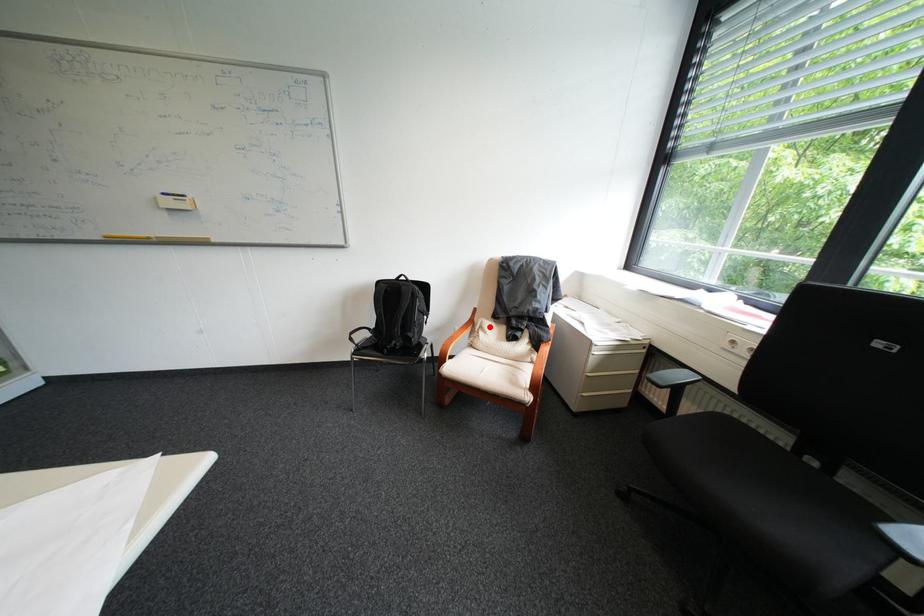
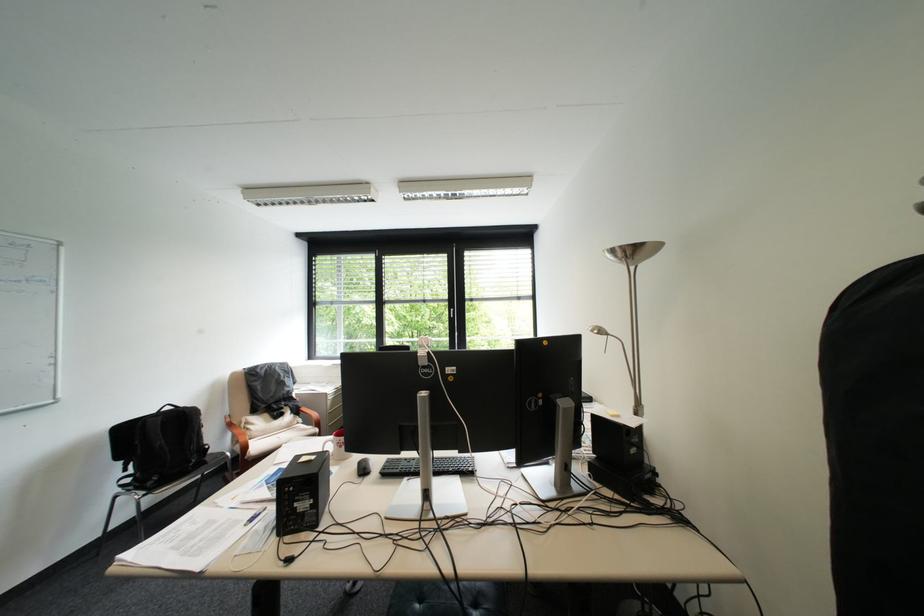
Locate, in the second image, the point that corresponds to the highlighted location in the first image.

(256, 424)